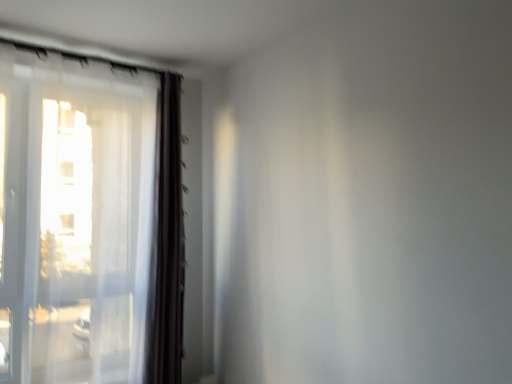
Question: Is dark brown fabric curtain at left taller than transparent fabric window at left?

Choices:
 (A) yes
 (B) no

Answer: (B)

Question: Is dark brown fabric curtain at left closer to the viewer compared to transparent fabric window at left?

Choices:
 (A) yes
 (B) no

Answer: (B)

Question: Does dark brown fabric curtain at left lie behind transparent fabric window at left?

Choices:
 (A) yes
 (B) no

Answer: (A)

Question: Is transparent fabric window at left completely or partially inside dark brown fabric curtain at left?

Choices:
 (A) yes
 (B) no

Answer: (B)

Question: Is dark brown fabric curtain at left facing away from transparent fabric window at left?

Choices:
 (A) no
 (B) yes

Answer: (B)

Question: In terms of width, does transparent fabric window at left look wider or thinner when compared to transparent plastic screen door at left?

Choices:
 (A) thin
 (B) wide

Answer: (A)

Question: Is transparent fabric window at left taller or shorter than transparent plastic screen door at left?

Choices:
 (A) short
 (B) tall

Answer: (B)

Question: Is transparent fabric window at left to the left or to the right of transparent plastic screen door at left in the image?

Choices:
 (A) left
 (B) right

Answer: (B)

Question: From the image's perspective, is transparent fabric window at left above or below transparent plastic screen door at left?

Choices:
 (A) below
 (B) above

Answer: (A)

Question: From a real-world perspective, is transparent plastic screen door at left physically located above or below dark brown fabric curtain at left?

Choices:
 (A) above
 (B) below

Answer: (A)

Question: In the image, is transparent plastic screen door at left on the left side or the right side of dark brown fabric curtain at left?

Choices:
 (A) left
 (B) right

Answer: (A)

Question: Considering the positions of transparent plastic screen door at left and dark brown fabric curtain at left in the image, is transparent plastic screen door at left bigger or smaller than dark brown fabric curtain at left?

Choices:
 (A) small
 (B) big

Answer: (A)

Question: Is transparent plastic screen door at left in front of or behind dark brown fabric curtain at left in the image?

Choices:
 (A) front
 (B) behind

Answer: (A)

Question: In terms of height, does transparent plastic screen door at left look taller or shorter compared to transparent fabric window at left?

Choices:
 (A) short
 (B) tall

Answer: (A)

Question: Is point (18, 340) positioned closer to the camera than point (119, 365)?

Choices:
 (A) farther
 (B) closer

Answer: (A)